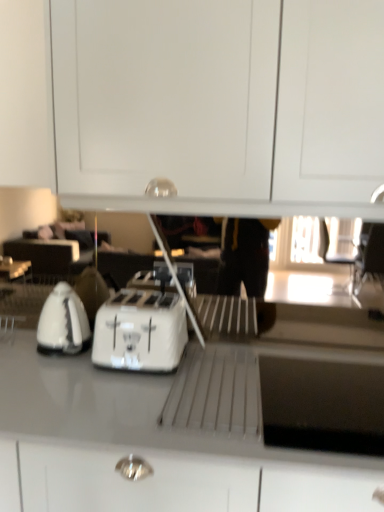
Locate an element on the screen. free space in front of white glossy kettle at left is located at coordinates (47, 375).